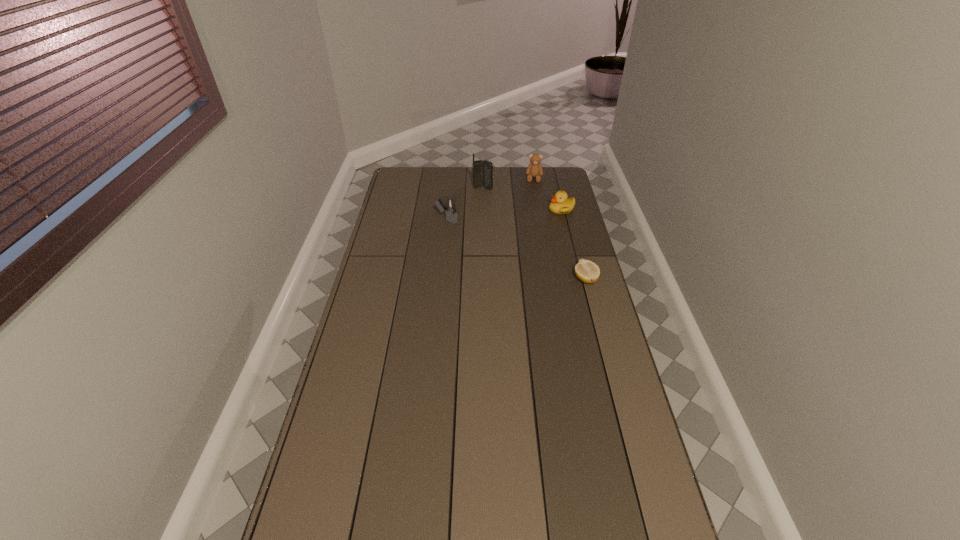
You are a GUI agent. You are given a task and a screenshot of the screen. Output one action in this format:
    pyautogui.click(x=<x>, y=<y>)
    Task: Click on the igniter
    The height and width of the screenshot is (540, 960).
    Given the screenshot: What is the action you would take?
    pyautogui.click(x=450, y=208)

Locate an element on the screen. the nearest object is located at coordinates (587, 271).

Identify the location of the shortest object. Image resolution: width=960 pixels, height=540 pixels. (587, 271).

The width and height of the screenshot is (960, 540). Identify the location of cellular telephone. (482, 170).

This screenshot has width=960, height=540. Identify the location of the tallest object. click(482, 170).

Find the location of a particular element. The height and width of the screenshot is (540, 960). duckling is located at coordinates (560, 204).

Locate an element on the screen. This screenshot has height=540, width=960. teddy bear is located at coordinates (534, 169).

This screenshot has width=960, height=540. Find the location of `free space located 0.240m on the left of the igniter`. free space located 0.240m on the left of the igniter is located at coordinates (383, 219).

Locate an element on the screen. vacant point located 0.330m on the left of the shortest object is located at coordinates (490, 279).

Where is `vacant area located on the keyboard of the cellular telephone`? The width and height of the screenshot is (960, 540). vacant area located on the keyboard of the cellular telephone is located at coordinates (499, 212).